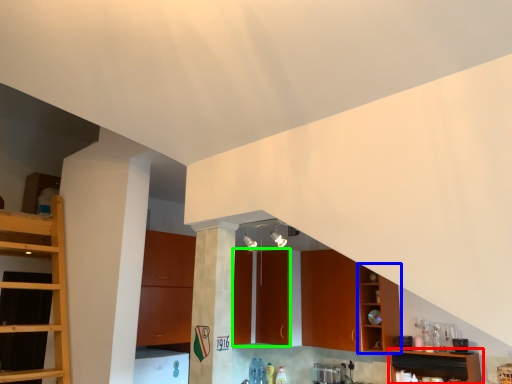
Question: Which is farther away from shelf (highlighted by a red box)? cabinetry (highlighted by a blue box) or cabinetry (highlighted by a green box)?

Choices:
 (A) cabinetry
 (B) cabinetry

Answer: (B)